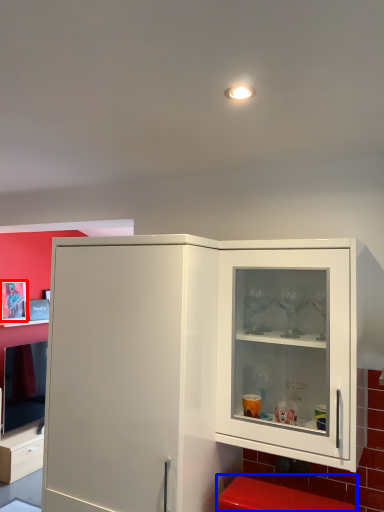
Question: Which of the following is the farthest to the observer, picture frame (highlighted by a red box) or step stool (highlighted by a blue box)?

Choices:
 (A) picture frame
 (B) step stool

Answer: (A)